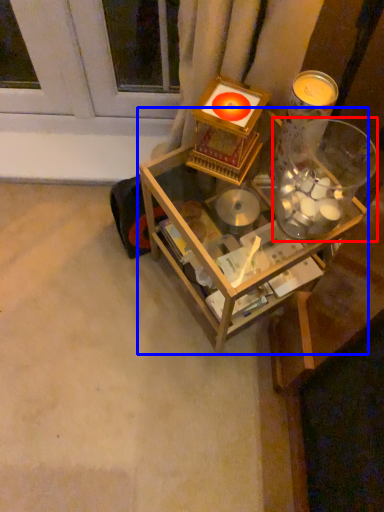
Question: Which of the following is the closest to the observer, glass jar (highlighted by a red box) or table (highlighted by a blue box)?

Choices:
 (A) glass jar
 (B) table

Answer: (A)